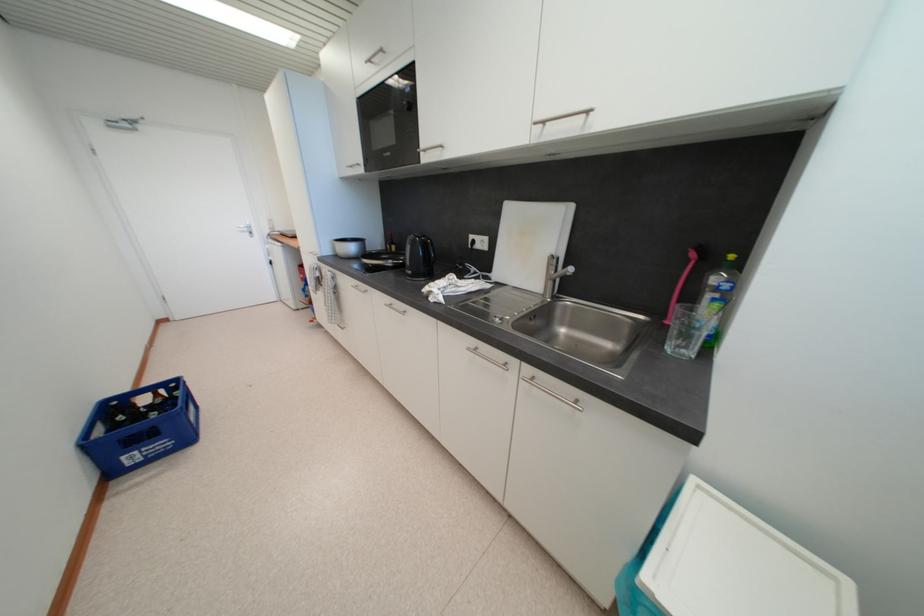
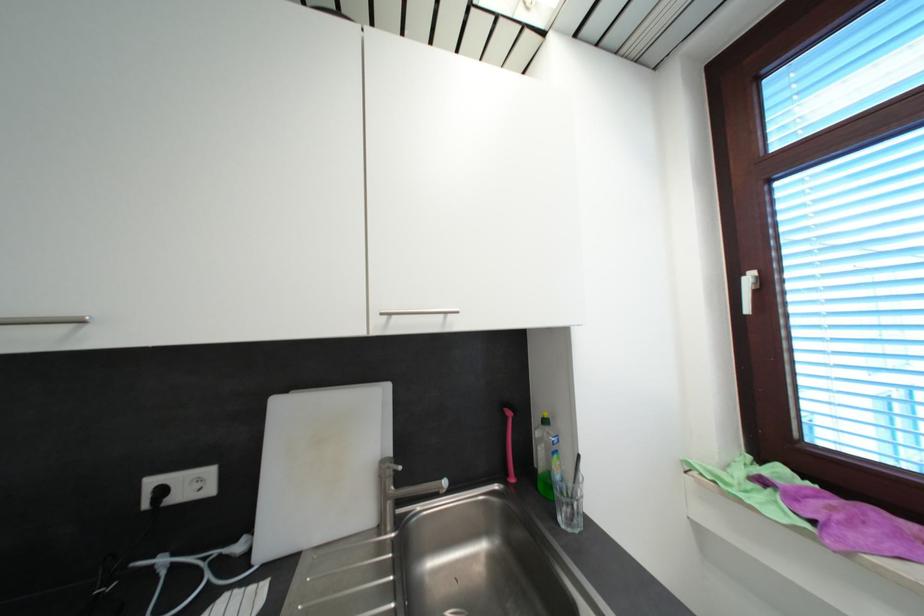
The point at (674,345) is marked in the first image. Where is the corresponding point in the second image?

(565, 522)